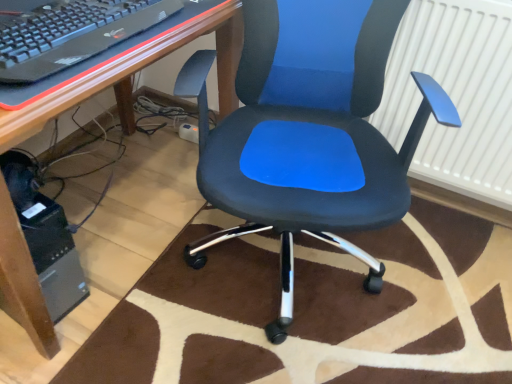
At what (x,y) coordinates should I click in order to perform the action: click on free spot above brown plush rug at center (from a real-world perspective). Please return your answer as a coordinate pair (x, y). Looking at the image, I should click on (335, 301).